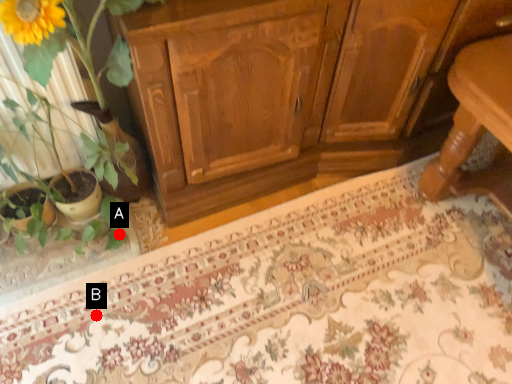
Question: Two points are circled on the image, labeled by A and B beside each circle. Which point is closer to the camera?

Choices:
 (A) A is closer
 (B) B is closer

Answer: (B)